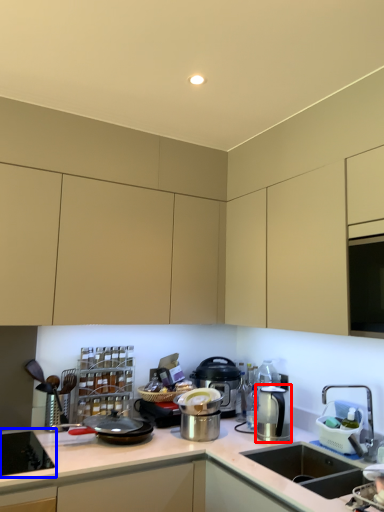
Question: Which point is further to the camera, kitchen appliance (highlighted by a red box) or home appliance (highlighted by a blue box)?

Choices:
 (A) kitchen appliance
 (B) home appliance

Answer: (A)